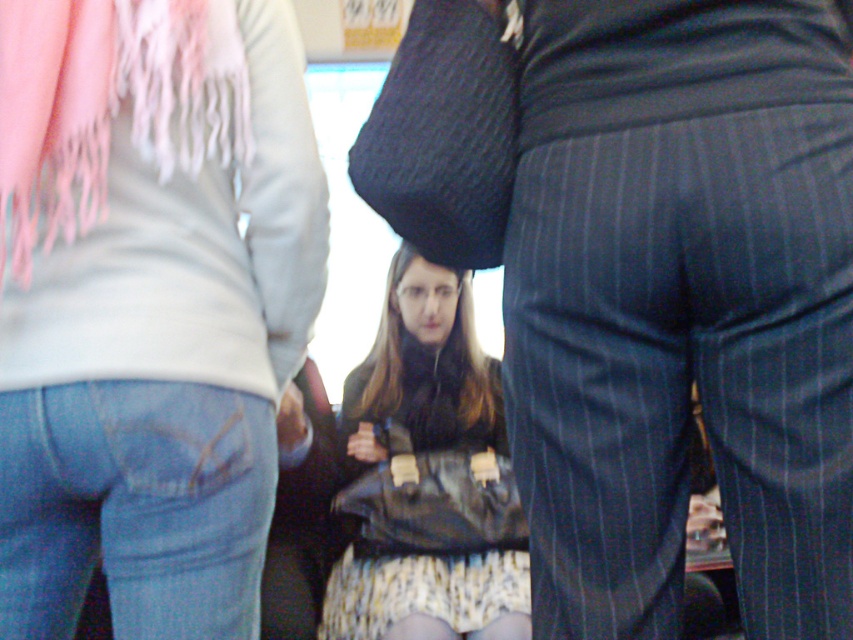
Can you confirm if pink fringed scarf at upper left is bigger than leather bag at center?

Incorrect, pink fringed scarf at upper left is not larger than leather bag at center.

Is pink fringed scarf at upper left below leather bag at center?

No.

Who is more forward, (x=183, y=51) or (x=415, y=628)?

Point (x=183, y=51) is in front.

Where is `pink fringed scarf at upper left`? The width and height of the screenshot is (853, 640). pink fringed scarf at upper left is located at coordinates (108, 104).